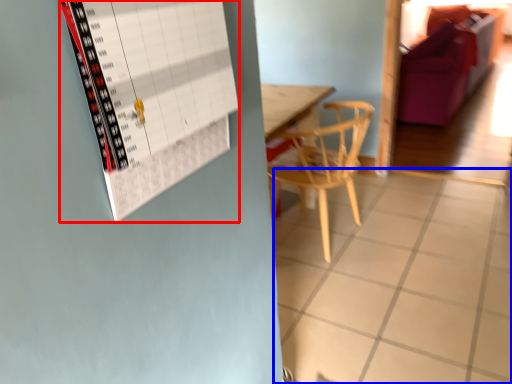
Question: Which object is further to the camera taking this photo, bulletin board (highlighted by a red box) or tile (highlighted by a blue box)?

Choices:
 (A) bulletin board
 (B) tile

Answer: (B)